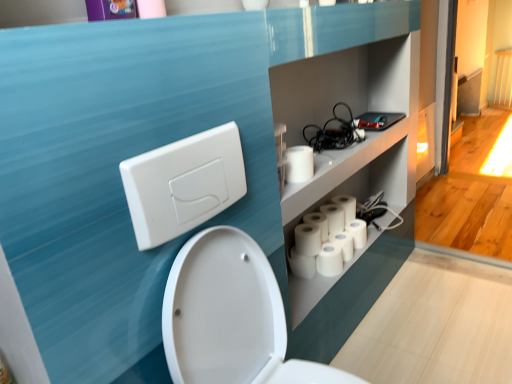
In order to face black rubber cables at upper right, should I rotate leftwards or rightwards?

Rotate your view right by about 11.063°.

What do you see at coordinates (346, 206) in the screenshot? I see `white matte toilet paper at lower center, positioned as the 1th toilet paper in back-to-front order` at bounding box center [346, 206].

I want to click on white glossy toilet at center, so click(x=230, y=317).

Where is `white plastic/light switch at upper left`? The height and width of the screenshot is (384, 512). white plastic/light switch at upper left is located at coordinates (183, 184).

Image resolution: width=512 pixels, height=384 pixels. What do you see at coordinates (298, 164) in the screenshot?
I see `white matte toilet paper at upper right, marked as the first toilet paper in a front-to-back arrangement` at bounding box center [298, 164].

What are the coordinates of `white matte toilet paper at lower center, which is counted as the 3th toilet paper, starting from the front` in the screenshot? It's located at (302, 264).

Locate an element on the screen. This screenshot has height=384, width=512. toiletry above the white plastic/light switch at upper left (from the image's perspective) is located at coordinates (111, 9).

Is purple glossy picture frame at upper left not close to white plastic/light switch at upper left?

purple glossy picture frame at upper left is actually quite close to white plastic/light switch at upper left.

From the picture: Is purple glossy picture frame at upper left oriented away from white plastic/light switch at upper left?

That's not correct — purple glossy picture frame at upper left is not looking away from white plastic/light switch at upper left.

Between purple glossy picture frame at upper left and white plastic/light switch at upper left, which one has smaller size?

With smaller size is white plastic/light switch at upper left.

From the image's perspective, is white plastic/light switch at upper left positioned above or below white matte toilet paper at center, positioned as the third toilet paper in back-to-front order?

From the image's perspective, white plastic/light switch at upper left appears above white matte toilet paper at center, positioned as the third toilet paper in back-to-front order.

Considering the positions of objects white plastic/light switch at upper left and white matte toilet paper at center, positioned as the third toilet paper in back-to-front order, in the image provided, who is more to the right, white plastic/light switch at upper left or white matte toilet paper at center, positioned as the third toilet paper in back-to-front order,?

Positioned to the right is white matte toilet paper at center, positioned as the third toilet paper in back-to-front order.

Who is taller, white plastic/light switch at upper left or white matte toilet paper at center, acting as the 4th toilet paper starting from the front?

white plastic/light switch at upper left.

Between point (239, 169) and point (331, 272), which one is positioned in front?

The point (239, 169) is closer to the camera.

How many degrees apart are the facing directions of black rubber cables at upper right and white matte toilet paper at lower center, the 5th toilet paper viewed from the back?

They differ by 0.000374 degrees in their facing directions.

From the image's perspective, which one is positioned lower, black rubber cables at upper right or white matte toilet paper at lower center, which appears as the 2th toilet paper when viewed from the front?

From the image's view, white matte toilet paper at lower center, which appears as the 2th toilet paper when viewed from the front, is below.

From a real-world perspective, which object rests below the other?

white matte toilet paper at lower center, the 5th toilet paper viewed from the back, from a real-world perspective.

In terms of width, does black rubber cables at upper right look wider or thinner when compared to white matte toilet paper at lower center, which appears as the 2th toilet paper when viewed from the front?

black rubber cables at upper right is wider than white matte toilet paper at lower center, which appears as the 2th toilet paper when viewed from the front.

Would you say white matte toilet paper at lower center, the 5th toilet paper positioned from the front, is a long distance from white matte toilet paper at center, positioned as the third toilet paper in back-to-front order?

No, white matte toilet paper at lower center, the 5th toilet paper positioned from the front, is in close proximity to white matte toilet paper at center, positioned as the third toilet paper in back-to-front order.

Does point (356, 235) appear closer or farther from the camera than point (342, 265)?

Point (356, 235).

Is white matte toilet paper at lower center, the 5th toilet paper positioned from the front, thinner than white matte toilet paper at lower center, which is the sixth toilet paper from front to back?

Yes, white matte toilet paper at lower center, the 5th toilet paper positioned from the front, is thinner than white matte toilet paper at lower center, which is the sixth toilet paper from front to back.

Does point (354, 243) lie in front of point (340, 197)?

Yes, point (354, 243) is closer to viewer.

Considering the positions of objects white matte toilet paper at lower center, marked as the 2th toilet paper in a back-to-front arrangement, and white matte toilet paper at lower center, which is the sixth toilet paper from front to back, in the image provided, who is more to the right, white matte toilet paper at lower center, marked as the 2th toilet paper in a back-to-front arrangement, or white matte toilet paper at lower center, which is the sixth toilet paper from front to back,?

white matte toilet paper at lower center, marked as the 2th toilet paper in a back-to-front arrangement, is more to the right.

Looking at the image, does white matte toilet paper at lower center, which is the sixth toilet paper from front to back, seem bigger or smaller compared to white glossy toilet at center?

white matte toilet paper at lower center, which is the sixth toilet paper from front to back, is smaller than white glossy toilet at center.

This screenshot has width=512, height=384. I want to click on toilet below the white matte toilet paper at lower center, which is the sixth toilet paper from front to back (from the image's perspective), so click(230, 317).

How different are the orientations of white matte toilet paper at lower center, which is the sixth toilet paper from front to back, and white glossy toilet at center in degrees?

The angle between the facing direction of white matte toilet paper at lower center, which is the sixth toilet paper from front to back, and the facing direction of white glossy toilet at center is 1.42 degrees.

Is white matte toilet paper at lower center, which is counted as the 3th toilet paper, starting from the front, inside the boundaries of white glossy toilet at center, or outside?

white matte toilet paper at lower center, which is counted as the 3th toilet paper, starting from the front, cannot be found inside white glossy toilet at center.

From the picture: Is there a large distance between white matte toilet paper at lower center, the 4th toilet paper in the back-to-front sequence, and white glossy toilet at center?

No, white matte toilet paper at lower center, the 4th toilet paper in the back-to-front sequence, is not far from white glossy toilet at center.

From the image's perspective, between white matte toilet paper at lower center, which is counted as the 3th toilet paper, starting from the front, and white glossy toilet at center, which one is located above?

From the image's view, white matte toilet paper at lower center, which is counted as the 3th toilet paper, starting from the front, is above.

At what (x,y) coordinates should I click in order to perform the action: click on light switch lying behind the purple glossy picture frame at upper left. Please return your answer as a coordinate pair (x, y). Image resolution: width=512 pixels, height=384 pixels. Looking at the image, I should click on (183, 184).

From a real-world perspective, starting from the white plastic/light switch at upper left, which toilet paper is the 5th one below it? Please provide its 2D coordinates.

[(330, 260)]

Based on their spatial positions, is white plastic/light switch at upper left or purple glossy picture frame at upper left closer to white matte toilet paper at lower center, the 4th toilet paper in the back-to-front sequence?

white plastic/light switch at upper left.

Considering their positions, is purple glossy picture frame at upper left positioned closer to white matte toilet paper at lower center, the 5th toilet paper viewed from the back, than white matte toilet paper at lower center, marked as the 2th toilet paper in a back-to-front arrangement?

Among the two, white matte toilet paper at lower center, marked as the 2th toilet paper in a back-to-front arrangement, is located nearer to white matte toilet paper at lower center, the 5th toilet paper viewed from the back.

Which object lies nearer to the anchor point white matte toilet paper at lower center, which appears as the 2th toilet paper when viewed from the front, white matte toilet paper at center, acting as the 4th toilet paper starting from the front, or purple glossy picture frame at upper left?

white matte toilet paper at center, acting as the 4th toilet paper starting from the front, is closer to white matte toilet paper at lower center, which appears as the 2th toilet paper when viewed from the front.

Estimate the real-world distances between objects in this image. Which object is further from black rubber cables at upper right, white matte toilet paper at lower center, which appears as the 2th toilet paper when viewed from the front, or white matte toilet paper at lower center, which is the sixth toilet paper from front to back?

Among the two, white matte toilet paper at lower center, which appears as the 2th toilet paper when viewed from the front, is located further to black rubber cables at upper right.

Considering their positions, is purple glossy picture frame at upper left positioned further to black rubber cables at upper right than white matte toilet paper at lower center, the 4th toilet paper in the back-to-front sequence?

Among the two, purple glossy picture frame at upper left is located further to black rubber cables at upper right.

From the image, which object appears to be farther from white plastic/light switch at upper left, white matte toilet paper at lower center, marked as the 2th toilet paper in a back-to-front arrangement, or white matte toilet paper at lower center, which is counted as the 3th toilet paper, starting from the front?

white matte toilet paper at lower center, marked as the 2th toilet paper in a back-to-front arrangement, is positioned further to the anchor white plastic/light switch at upper left.

Looking at this image, considering their positions, is white matte toilet paper at upper right, marked as the first toilet paper in a front-to-back arrangement, positioned further to white plastic/light switch at upper left than white matte toilet paper at lower center, which is the sixth toilet paper from front to back?

The object further to white plastic/light switch at upper left is white matte toilet paper at lower center, which is the sixth toilet paper from front to back.

Estimate the real-world distances between objects in this image. Which object is closer to white matte toilet paper at lower center, positioned as the 1th toilet paper in back-to-front order, white matte toilet paper at lower center, the 5th toilet paper viewed from the back, or white matte toilet paper at lower center, which is counted as the 3th toilet paper, starting from the front?

Among the two, white matte toilet paper at lower center, the 5th toilet paper viewed from the back, is located nearer to white matte toilet paper at lower center, positioned as the 1th toilet paper in back-to-front order.

The width and height of the screenshot is (512, 384). What are the coordinates of `cable between white plastic/light switch at upper left and white matte toilet paper at lower center, marked as the 2th toilet paper in a back-to-front arrangement, from front to back` in the screenshot? It's located at (335, 132).

You are a GUI agent. You are given a task and a screenshot of the screen. Output one action in this format:
    pyautogui.click(x=<x>, y=<y>)
    Task: Click on the cable between purple glossy picture frame at upper left and white matte toilet paper at center, acting as the 4th toilet paper starting from the front, from front to back
    The image size is (512, 384).
    Given the screenshot: What is the action you would take?
    pyautogui.click(x=335, y=132)

The width and height of the screenshot is (512, 384). I want to click on cable between purple glossy picture frame at upper left and white matte toilet paper at lower center, which is counted as the 3th toilet paper, starting from the front, from front to back, so click(335, 132).

Find the location of a particular element. light switch between white glossy toilet at center and white matte toilet paper at lower center, which appears as the 2th toilet paper when viewed from the front, along the z-axis is located at coordinates (183, 184).